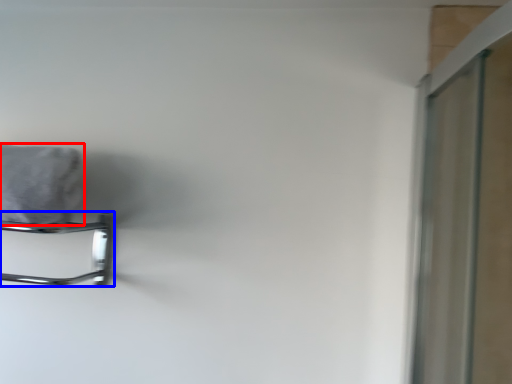
Question: Which of the following is the farthest to the observer, bath towel (highlighted by a red box) or towel rack (highlighted by a blue box)?

Choices:
 (A) bath towel
 (B) towel rack

Answer: (B)